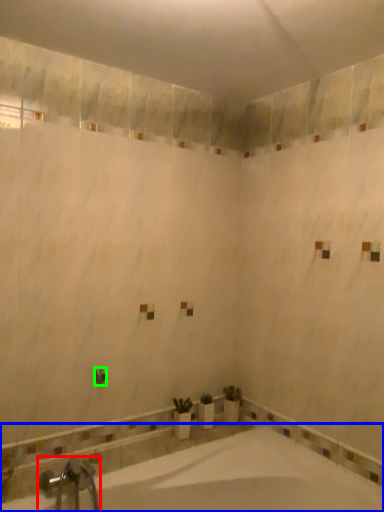
Question: Which is nearer to the tap (highlighted by a red box)? bathtub (highlighted by a blue box) or shower (highlighted by a green box).

Choices:
 (A) bathtub
 (B) shower

Answer: (A)